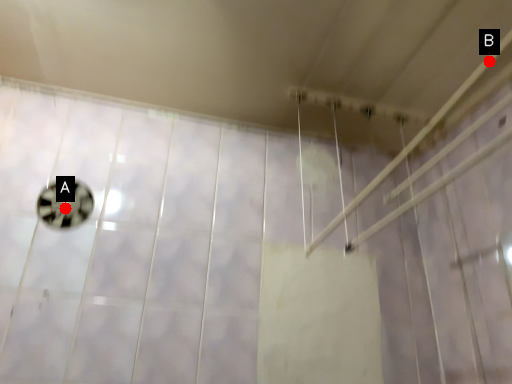
Question: Two points are circled on the image, labeled by A and B beside each circle. Which point is closer to the camera?

Choices:
 (A) A is closer
 (B) B is closer

Answer: (B)